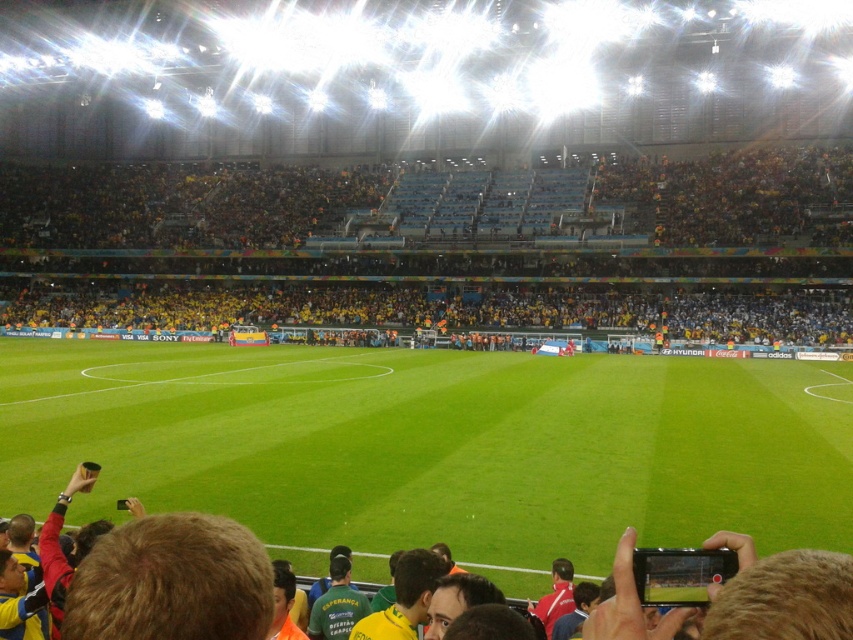
You are a photographer standing at the edge of the soccer field. You want to take a photo that includes both the green grass at center and the yellow fabric seats at upper center. Based on their positions, which object should appear lower in the photo?

The green grass at center is positioned under the yellow fabric seats at upper center, so in the photo, the green grass at center will appear lower than the yellow fabric seats at upper center.

You are sitting in the brown leather jacket at lower center and want to move to the yellow fabric seats at upper center. Which direction should you move to reach them?

The yellow fabric seats at upper center are to the left of the brown leather jacket at lower center, so you should move to the left to reach them.